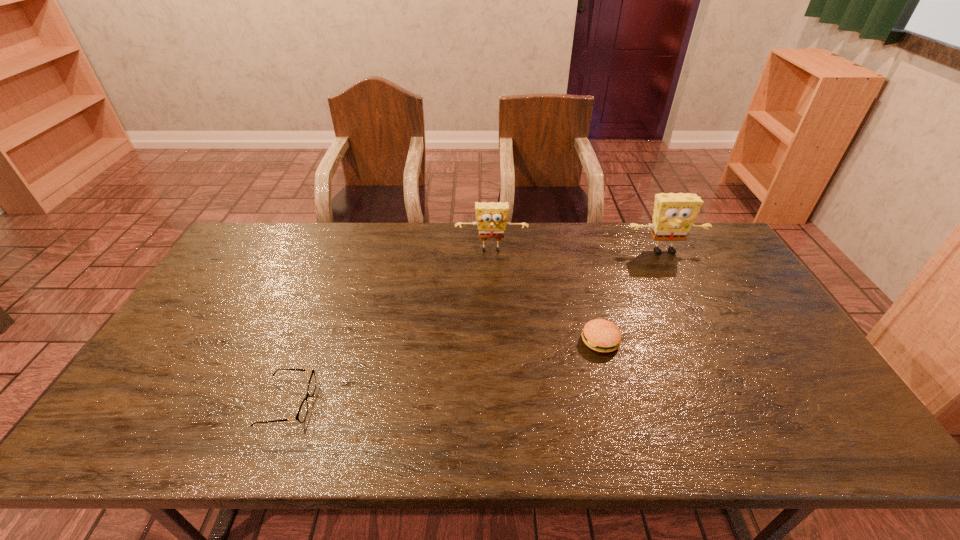
You are a GUI agent. You are given a task and a screenshot of the screen. Output one action in this format:
    pyautogui.click(x=<x>, y=<y>)
    Task: Click on the rightmost object
    Image resolution: width=960 pixels, height=540 pixels.
    Given the screenshot: What is the action you would take?
    pyautogui.click(x=674, y=214)

The width and height of the screenshot is (960, 540). Find the location of `the right sponge`. the right sponge is located at coordinates (674, 214).

I want to click on the left sponge, so click(491, 217).

Find the location of `the third shortest object`. the third shortest object is located at coordinates (491, 217).

Locate an element on the screen. the third object from left to right is located at coordinates (601, 335).

Locate an element on the screen. Image resolution: width=960 pixels, height=540 pixels. the third tallest object is located at coordinates (601, 335).

I want to click on spectacles, so click(302, 412).

Where is `the leftmost object`? Image resolution: width=960 pixels, height=540 pixels. the leftmost object is located at coordinates (302, 412).

Find the location of a particular element. free space located on the face of the rightmost object is located at coordinates (697, 316).

At what (x,y) coordinates should I click in order to perform the action: click on blank area located on the face of the third shortest object. Please return your answer as a coordinate pair (x, y). The height and width of the screenshot is (540, 960). Looking at the image, I should click on (493, 326).